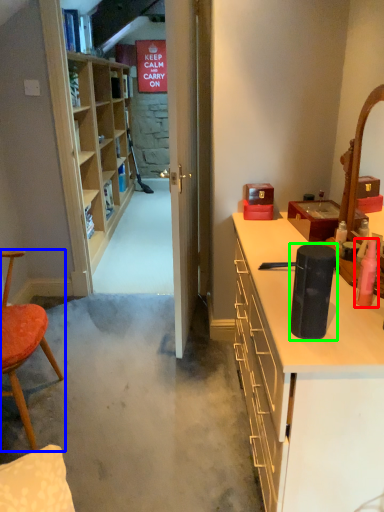
Question: Which is farther away from toiletry (highlighted by a red box)? chair (highlighted by a blue box) or appliance (highlighted by a green box)?

Choices:
 (A) chair
 (B) appliance

Answer: (A)